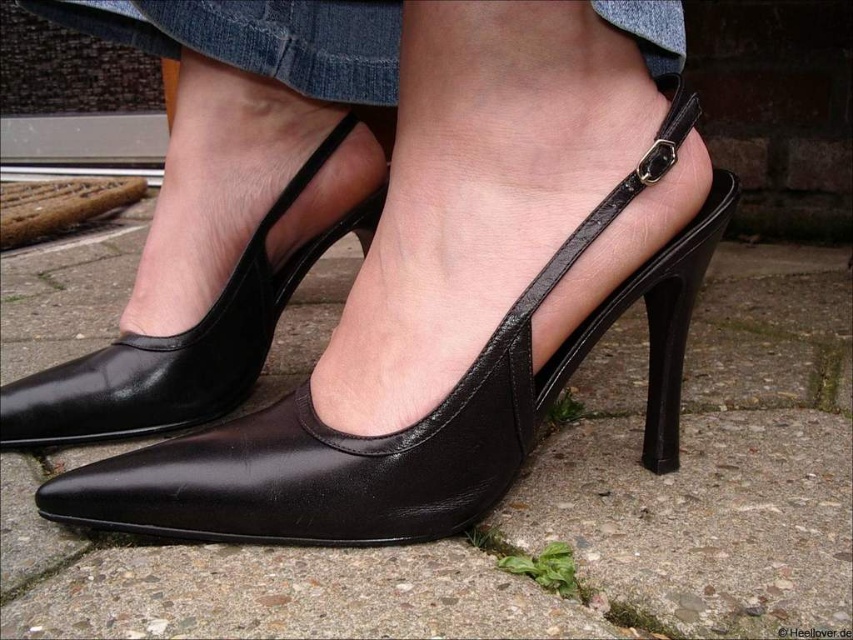
Is black leather sandal at center positioned in front of black leather shoe at center?

Yes.

Does black leather sandal at center have a lesser height compared to black leather shoe at center?

Correct, black leather sandal at center is not as tall as black leather shoe at center.

Locate an element on the screen. The width and height of the screenshot is (853, 640). black leather sandal at center is located at coordinates [419, 419].